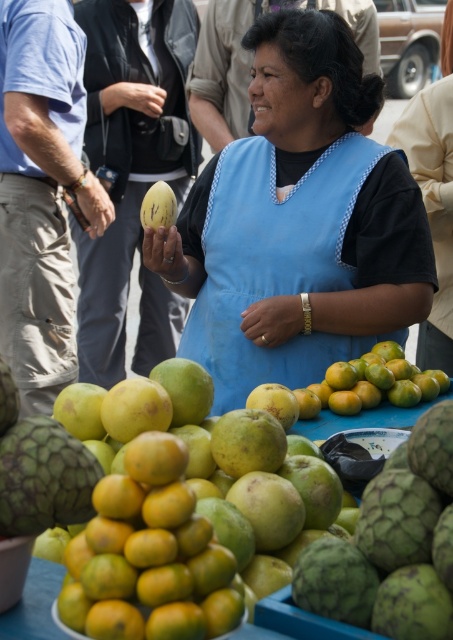
Question: Can you confirm if smooth green fruit at center is positioned below green matte melon at center?

Choices:
 (A) no
 (B) yes

Answer: (B)

Question: Is smooth green fruit at center positioned before smooth orange tangerine at lower left?

Choices:
 (A) yes
 (B) no

Answer: (B)

Question: Considering the real-world distances, which object is closest to the smooth green fruit at center?

Choices:
 (A) blue fabric dress at center
 (B) smooth orange tangerine at lower left

Answer: (B)

Question: Does smooth green fruit at center have a lesser width compared to green matte melon at center?

Choices:
 (A) yes
 (B) no

Answer: (B)

Question: Which of the following is the farthest from the observer?

Choices:
 (A) smooth orange tangerine at lower left
 (B) blue fabric dress at center
 (C) smooth green fruit at center

Answer: (B)

Question: Which object appears farthest from the camera in this image?

Choices:
 (A) smooth orange tangerine at lower left
 (B) green matte melon at center
 (C) smooth green fruit at center

Answer: (B)